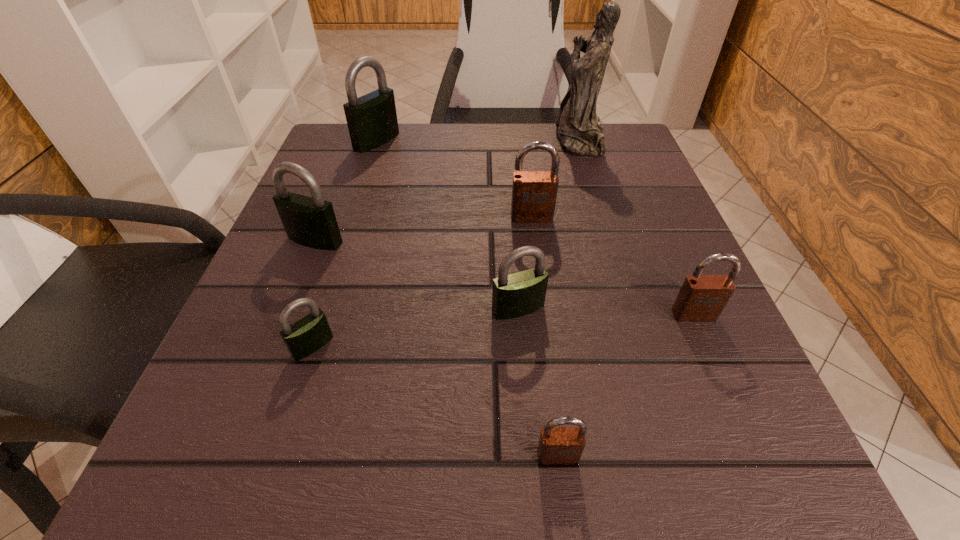
What are the coordinates of `object at the far left corner` in the screenshot? It's located at (372, 121).

Where is `object present at the far right corner`? This screenshot has width=960, height=540. object present at the far right corner is located at coordinates (579, 130).

I want to click on free space at the far edge of the desktop, so click(435, 146).

Image resolution: width=960 pixels, height=540 pixels. What are the coordinates of `vacant area at the near edge` in the screenshot? It's located at (358, 486).

You are a GUI agent. You are given a task and a screenshot of the screen. Output one action in this format:
    pyautogui.click(x=<x>, y=<y>)
    Task: Click on the blank space at the left edge of the desktop
    The width and height of the screenshot is (960, 540).
    Given the screenshot: What is the action you would take?
    pyautogui.click(x=324, y=282)

You are a GUI agent. You are given a task and a screenshot of the screen. Output one action in this format:
    pyautogui.click(x=<x>, y=<y>)
    Task: Click on the vacant space at the right edge
    The image size is (960, 540).
    Given the screenshot: What is the action you would take?
    pyautogui.click(x=726, y=327)

In the image, there is a desktop. Where is `vacant space at the near left corner`? vacant space at the near left corner is located at coordinates (291, 501).

Find the location of a particular element. This screenshot has width=960, height=540. free space at the far right corner of the desktop is located at coordinates (581, 168).

Identify the location of blank area at the near right corner. (771, 467).

Locate an element on the screen. The height and width of the screenshot is (540, 960). vacant space in between the second farthest padlock and the farthest black padlock is located at coordinates click(454, 179).